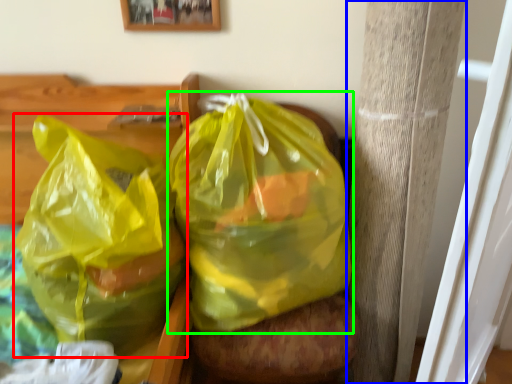
Question: Which object is positioned closest to plastic bag (highlighted by a red box)? Select from pillar (highlighted by a blue box) and plastic bag (highlighted by a green box).

Choices:
 (A) pillar
 (B) plastic bag

Answer: (B)